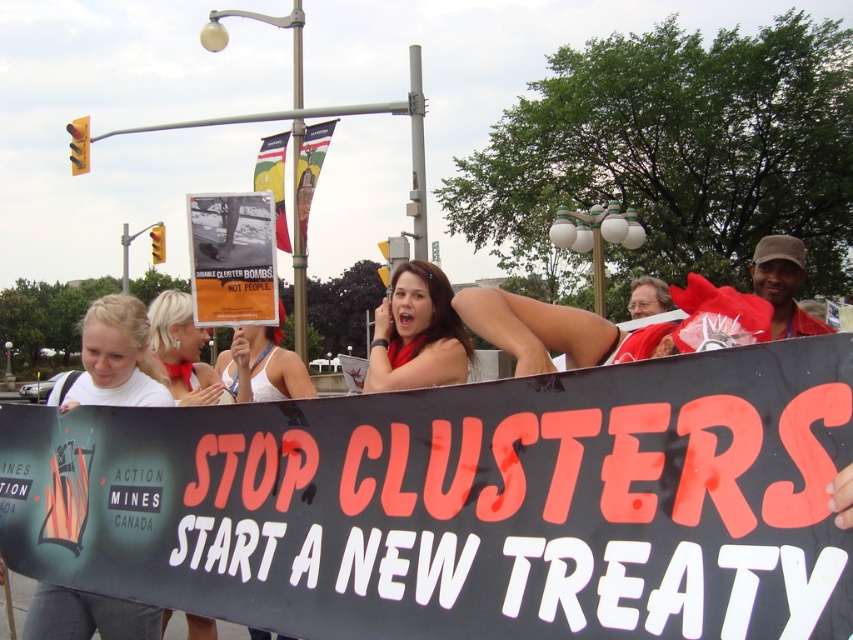
You are a photographer trying to capture the protest scene. You want to ensure both the paper poster at center and the blonde hair at center are visible in your shot. Given their sizes, which one should you focus on to avoid cropping out the smaller object?

The paper poster at center is smaller than the blonde hair at center, so you should focus on the paper poster at center to ensure it isn not cropped out.

What is the exact coordinate of the paper poster at center?

The paper poster at center is located at coordinate point (231,259).